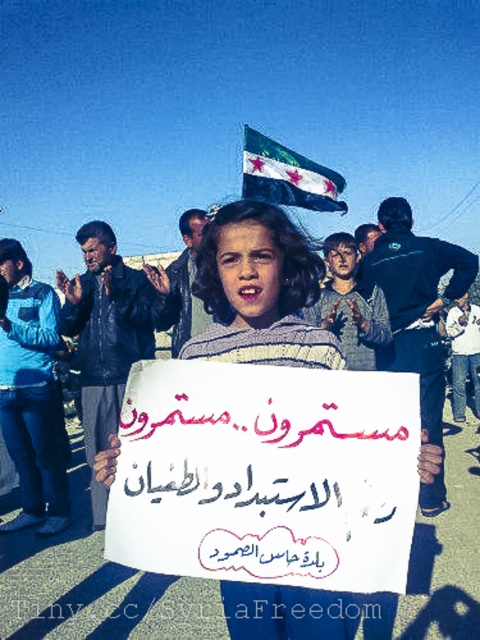
You are a photographer at the protest scene. You want to capture a photo where both the white striped sweater at center and the dark blue fabric flag at upper center are clearly visible. Given their sizes, will the flag take up more space in the photo than the sweater?

The white striped sweater at center occupies less space than dark blue fabric flag at upper center, so yes, the flag will take up more space in the photo than the sweater.

You are a photographer at the protest scene. You need to capture a photo where both the white striped sweater at center and the dark blue fabric flag at upper center are visible. Which object will appear narrower in the photo?

The white striped sweater at center will appear narrower in the photo because it is thinner than the dark blue fabric flag at upper center.

You are a photographer trying to capture the protest scene. You notice the white striped sweater at center and the dark blue fabric flag at upper center. Which object is located more to the left in the image?

The white striped sweater at center is positioned on the left side of dark blue fabric flag at upper center, so it is more to the left.